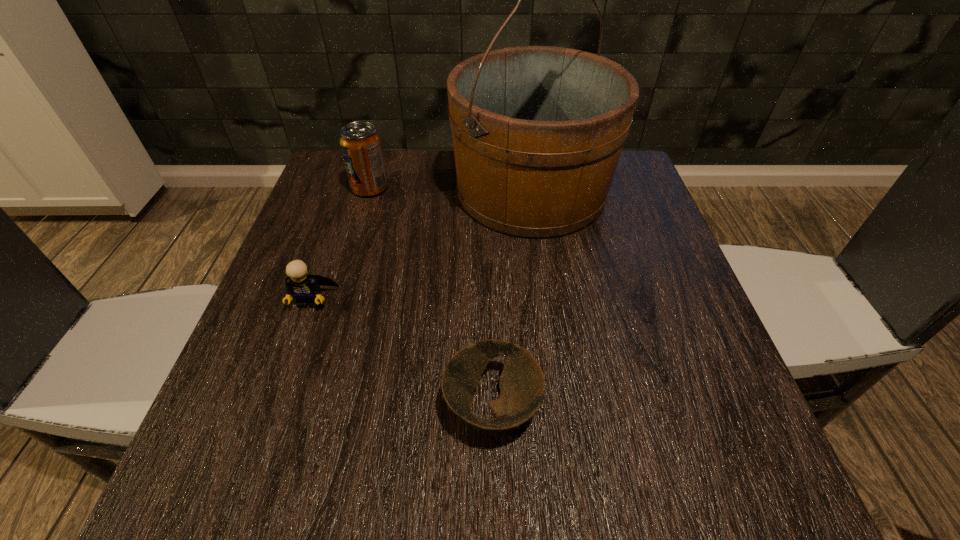
Where is `bucket that is at the far edge`? The width and height of the screenshot is (960, 540). bucket that is at the far edge is located at coordinates (538, 131).

Image resolution: width=960 pixels, height=540 pixels. What are the coordinates of `soda can that is at the far edge` in the screenshot? It's located at (361, 145).

Find the location of a particular element. object that is at the near edge is located at coordinates (522, 385).

The width and height of the screenshot is (960, 540). Find the location of `soda can that is positioned at the left edge`. soda can that is positioned at the left edge is located at coordinates (361, 145).

Locate an element on the screen. This screenshot has height=540, width=960. Lego that is at the left edge is located at coordinates (305, 288).

Find the location of `object positioned at the right edge`. object positioned at the right edge is located at coordinates click(x=538, y=131).

In order to click on object located in the far left corner section of the desktop in this screenshot , I will do `click(361, 145)`.

At what (x,y) coordinates should I click in order to perform the action: click on object present at the far right corner. Please return your answer as a coordinate pair (x, y). This screenshot has width=960, height=540. Looking at the image, I should click on (538, 131).

Identify the location of blank area at the far edge. (413, 161).

The height and width of the screenshot is (540, 960). Find the location of `free space at the left edge of the desktop`. free space at the left edge of the desktop is located at coordinates (306, 220).